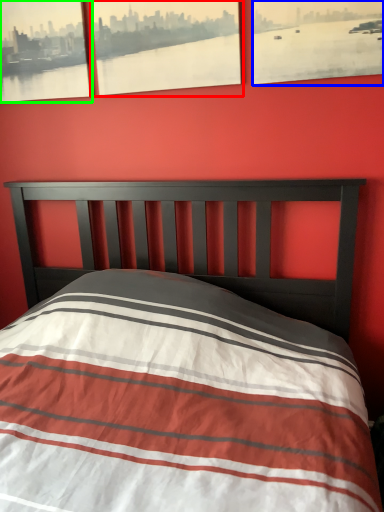
Question: Which is nearer to the picture frame (highlighted by a red box)? picture frame (highlighted by a blue box) or picture frame (highlighted by a green box).

Choices:
 (A) picture frame
 (B) picture frame

Answer: (B)